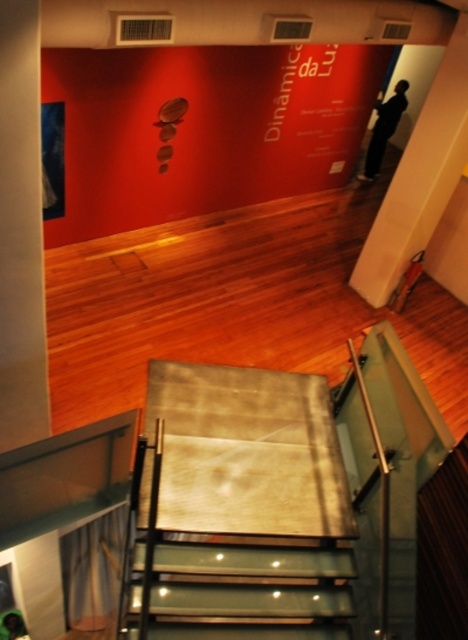
Question: Which object appears farthest from the camera in this image?

Choices:
 (A) black matte pants at upper right
 (B) green fabric person at lower left
 (C) clear glass stairs at center

Answer: (A)

Question: Can you confirm if black matte pants at upper right is positioned below green fabric person at lower left?

Choices:
 (A) no
 (B) yes

Answer: (A)

Question: Which point is closer to the camera?

Choices:
 (A) (137, 596)
 (B) (367, 177)

Answer: (A)

Question: Does clear glass stairs at center come in front of black matte pants at upper right?

Choices:
 (A) yes
 (B) no

Answer: (A)

Question: Among these objects, which one is nearest to the camera?

Choices:
 (A) green fabric person at lower left
 (B) black matte pants at upper right
 (C) clear glass stairs at center

Answer: (C)

Question: Does clear glass stairs at center have a larger size compared to green fabric person at lower left?

Choices:
 (A) yes
 (B) no

Answer: (A)